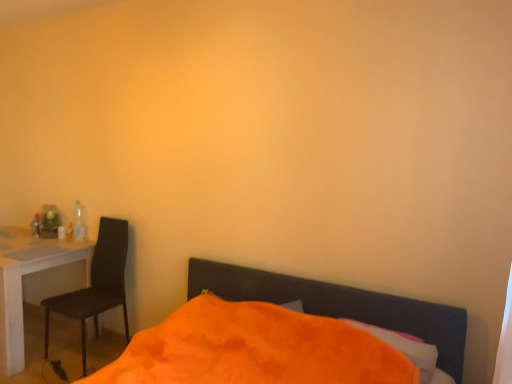
Question: Does white glossy desk at left have a lesser width compared to orange fuzzy bed at lower center?

Choices:
 (A) no
 (B) yes

Answer: (B)

Question: Is white glossy desk at left looking in the opposite direction of orange fuzzy bed at lower center?

Choices:
 (A) no
 (B) yes

Answer: (A)

Question: Considering the relative sizes of white glossy desk at left and orange fuzzy bed at lower center in the image provided, is white glossy desk at left bigger than orange fuzzy bed at lower center?

Choices:
 (A) no
 (B) yes

Answer: (A)

Question: Is white glossy desk at left not near orange fuzzy bed at lower center?

Choices:
 (A) yes
 (B) no

Answer: (A)

Question: From the image's perspective, is white glossy desk at left below orange fuzzy bed at lower center?

Choices:
 (A) yes
 (B) no

Answer: (B)

Question: From the image's perspective, is white glossy desk at left located above orange fuzzy bed at lower center?

Choices:
 (A) yes
 (B) no

Answer: (A)

Question: Does orange soft pillow at lower center contain translucent plastic bottle at left?

Choices:
 (A) no
 (B) yes

Answer: (A)

Question: Is orange soft pillow at lower center touching translucent plastic bottle at left?

Choices:
 (A) yes
 (B) no

Answer: (B)

Question: Can you confirm if orange soft pillow at lower center is shorter than translucent plastic bottle at left?

Choices:
 (A) yes
 (B) no

Answer: (A)

Question: Is orange soft pillow at lower center facing towards translucent plastic bottle at left?

Choices:
 (A) yes
 (B) no

Answer: (B)

Question: Considering the relative sizes of orange soft pillow at lower center and translucent plastic bottle at left in the image provided, is orange soft pillow at lower center taller than translucent plastic bottle at left?

Choices:
 (A) no
 (B) yes

Answer: (A)

Question: Is orange soft pillow at lower center bigger than translucent plastic bottle at left?

Choices:
 (A) yes
 (B) no

Answer: (A)

Question: Does black matte chair at left appear on the left side of orange soft pillow at lower center?

Choices:
 (A) no
 (B) yes

Answer: (B)